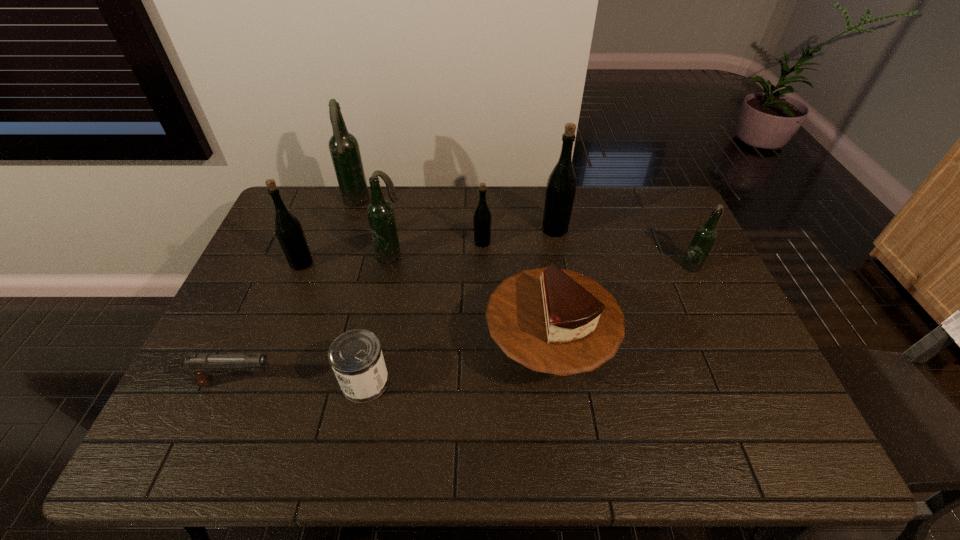
The width and height of the screenshot is (960, 540). Identify the location of the smallest dark beer bottle. (705, 236).

This screenshot has width=960, height=540. Find the location of `the rightmost dark beer bottle`. the rightmost dark beer bottle is located at coordinates (705, 236).

You are a GUI agent. You are given a task and a screenshot of the screen. Output one action in this format:
    pyautogui.click(x=<x>, y=<y>)
    Task: Click on the cake
    
    Given the screenshot: What is the action you would take?
    pyautogui.click(x=551, y=320)

At what (x,y) coordinates should I click in order to perform the action: click on can. Please return your answer as a coordinate pair (x, y). This screenshot has height=540, width=960. Looking at the image, I should click on (356, 357).

The image size is (960, 540). I want to click on gray gun, so coord(202,366).

You are a GUI agent. You are given a task and a screenshot of the screen. Output one action in this format:
    pyautogui.click(x=<x>, y=<y>)
    Task: Click on the blank area located 0.320m on the front of the farthest dark beer bottle
    This screenshot has height=540, width=960.
    Given the screenshot: What is the action you would take?
    pyautogui.click(x=330, y=280)

You are a GUI agent. You are given a task and a screenshot of the screen. Output one action in this format:
    pyautogui.click(x=<x>, y=<y>)
    Task: Click on the vacant space located 0.360m on the right of the fifth beer bottle from left to right
    
    Given the screenshot: What is the action you would take?
    pyautogui.click(x=676, y=230)

Where is `vacant space located 0.330m on the right of the leftmost beer bottle`? This screenshot has width=960, height=540. vacant space located 0.330m on the right of the leftmost beer bottle is located at coordinates (421, 263).

The image size is (960, 540). Find the location of `vacant region located 0.120m on the front of the third beer bottle from left to right`. vacant region located 0.120m on the front of the third beer bottle from left to right is located at coordinates (383, 293).

This screenshot has height=540, width=960. What are the coordinates of `free region located 0.050m on the front of the smallest green beer bottle` in the screenshot? It's located at (483, 259).